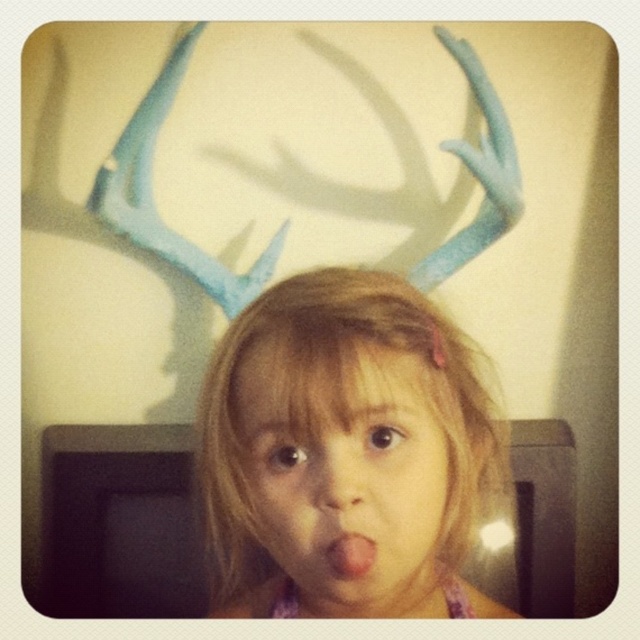
Question: Can you confirm if smooth skin nose at center is positioned above pink matte tongue at center?

Choices:
 (A) yes
 (B) no

Answer: (A)

Question: Based on their relative distances, which object is farther from the matte pink hair at center?

Choices:
 (A) blonde hair at center
 (B) pink matte tongue at center
 (C) smooth skin nose at center

Answer: (A)

Question: Which point is farther to the camera?

Choices:
 (A) (371, 545)
 (B) (422, 374)
 (C) (333, 436)
 (D) (353, 509)

Answer: (B)

Question: Which of the following is the farthest from the observer?

Choices:
 (A) pink matte tongue at center
 (B) blonde hair at center
 (C) smooth skin nose at center
 (D) matte pink hair at center

Answer: (A)

Question: Is blonde hair at center thinner than smooth skin nose at center?

Choices:
 (A) yes
 (B) no

Answer: (B)

Question: In this image, where is blonde hair at center located relative to matte pink hair at center?

Choices:
 (A) below
 (B) above

Answer: (A)